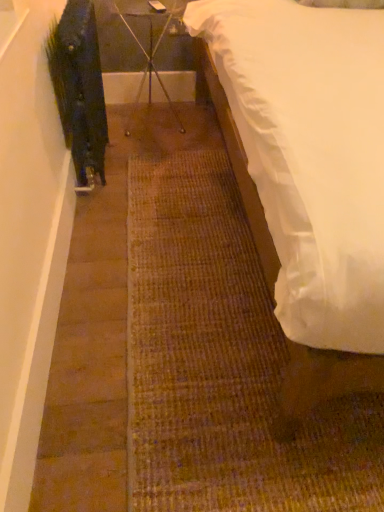
Question: From a real-world perspective, is metal tripod at center positioned under green matte plant at left based on gravity?

Choices:
 (A) yes
 (B) no

Answer: (A)

Question: From a real-world perspective, is metal tripod at center located higher than green matte plant at left?

Choices:
 (A) no
 (B) yes

Answer: (A)

Question: Is metal tripod at center turned away from green matte plant at left?

Choices:
 (A) yes
 (B) no

Answer: (B)

Question: Does metal tripod at center have a greater width compared to green matte plant at left?

Choices:
 (A) no
 (B) yes

Answer: (B)

Question: Is the position of metal tripod at center more distant than that of green matte plant at left?

Choices:
 (A) yes
 (B) no

Answer: (A)

Question: Considering the positions of point (99, 93) and point (147, 60), is point (99, 93) closer or farther from the camera than point (147, 60)?

Choices:
 (A) farther
 (B) closer

Answer: (B)

Question: Is green matte plant at left in front of or behind metal tripod at center in the image?

Choices:
 (A) behind
 (B) front

Answer: (B)

Question: Is green matte plant at left spatially inside metal tripod at center, or outside of it?

Choices:
 (A) outside
 (B) inside

Answer: (A)

Question: Considering the positions of green matte plant at left and metal tripod at center in the image, is green matte plant at left wider or thinner than metal tripod at center?

Choices:
 (A) thin
 (B) wide

Answer: (A)

Question: From the image's perspective, relative to green matte plant at left, is white satin bed at right above or below?

Choices:
 (A) above
 (B) below

Answer: (B)

Question: Is point pyautogui.click(x=334, y=161) closer or farther from the camera than point pyautogui.click(x=71, y=0)?

Choices:
 (A) closer
 (B) farther

Answer: (A)

Question: Considering the relative positions of white satin bed at right and green matte plant at left in the image provided, is white satin bed at right to the left or to the right of green matte plant at left?

Choices:
 (A) left
 (B) right

Answer: (B)

Question: Considering their positions, is white satin bed at right located in front of or behind green matte plant at left?

Choices:
 (A) front
 (B) behind

Answer: (A)

Question: From the image's perspective, is metal tripod at center located above or below white satin bed at right?

Choices:
 (A) below
 (B) above

Answer: (B)

Question: Relative to white satin bed at right, is metal tripod at center in front or behind?

Choices:
 (A) behind
 (B) front

Answer: (A)